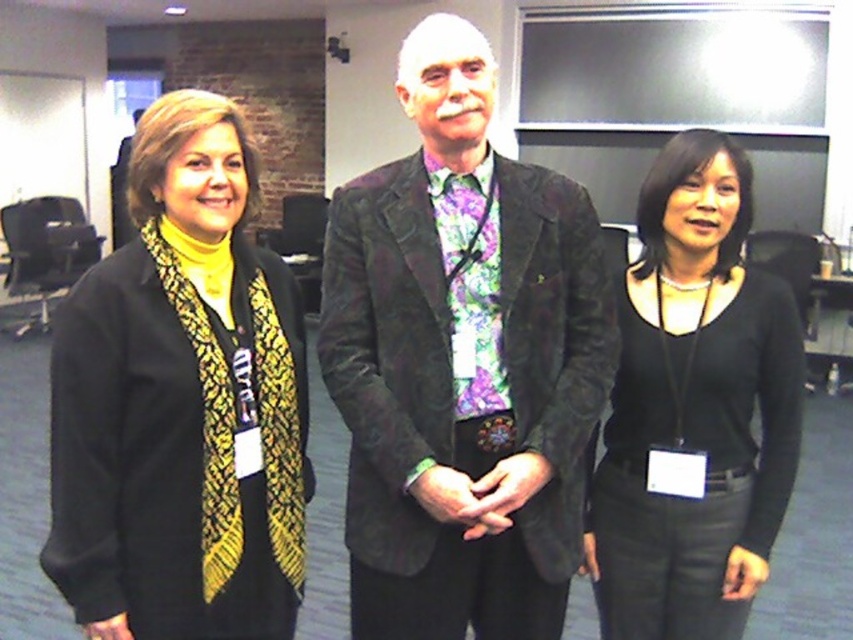
Question: Is black textured scarf at left wider than black matte shirt at right?

Choices:
 (A) yes
 (B) no

Answer: (B)

Question: Can you confirm if velvet-like brown blazer at center is positioned to the right of black matte shirt at right?

Choices:
 (A) no
 (B) yes

Answer: (A)

Question: Which point appears closest to the camera in this image?

Choices:
 (A) (231, 442)
 (B) (421, 278)
 (C) (664, 362)
 (D) (483, 387)

Answer: (A)

Question: Can you confirm if black textured scarf at left is bigger than floral silk tie at center?

Choices:
 (A) no
 (B) yes

Answer: (B)

Question: Which point is farther to the camera?

Choices:
 (A) (666, 161)
 (B) (422, 93)
 (C) (479, 352)

Answer: (A)

Question: Based on their relative distances, which object is farther from the black textured scarf at left?

Choices:
 (A) black matte shirt at right
 (B) floral silk tie at center

Answer: (A)